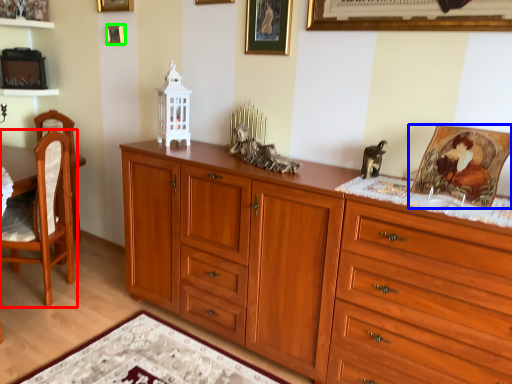
Question: Based on their relative distances, which object is farther from chair (highlighted by a red box)? Choose from picture frame (highlighted by a blue box) and picture frame (highlighted by a green box).

Choices:
 (A) picture frame
 (B) picture frame

Answer: (A)